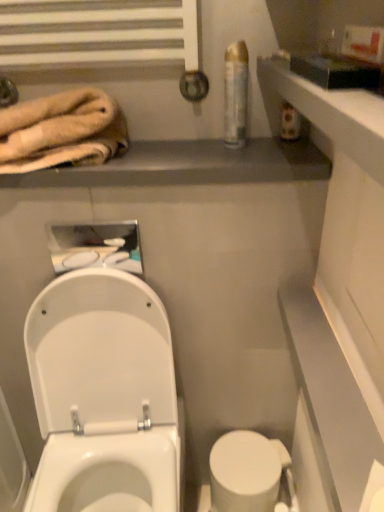
Question: Does white glossy toilet at lower left have a greater width compared to clear plastic can at upper right?

Choices:
 (A) yes
 (B) no

Answer: (A)

Question: Is white glossy toilet at lower left located outside clear plastic can at upper right?

Choices:
 (A) no
 (B) yes

Answer: (B)

Question: Does white glossy toilet at lower left appear on the left side of clear plastic can at upper right?

Choices:
 (A) yes
 (B) no

Answer: (A)

Question: Does white glossy toilet at lower left have a lesser height compared to clear plastic can at upper right?

Choices:
 (A) yes
 (B) no

Answer: (B)

Question: Does white glossy toilet at lower left have a lesser width compared to clear plastic can at upper right?

Choices:
 (A) yes
 (B) no

Answer: (B)

Question: Considering their positions, is white glossy toilet at lower left located in front of or behind white glossy toilet bowl at lower center?

Choices:
 (A) behind
 (B) front

Answer: (B)

Question: Considering the positions of point (89, 502) and point (246, 506), is point (89, 502) closer or farther from the camera than point (246, 506)?

Choices:
 (A) closer
 (B) farther

Answer: (B)

Question: From a real-world perspective, is white glossy toilet at lower left physically located above or below white glossy toilet bowl at lower center?

Choices:
 (A) below
 (B) above

Answer: (B)

Question: Looking at the image, does white glossy toilet at lower left seem bigger or smaller compared to white glossy toilet bowl at lower center?

Choices:
 (A) big
 (B) small

Answer: (A)

Question: Is white glossy toilet at lower left inside the boundaries of beige plush towel at upper left, or outside?

Choices:
 (A) inside
 (B) outside

Answer: (B)

Question: From the image's perspective, is white glossy toilet at lower left located above or below beige plush towel at upper left?

Choices:
 (A) above
 (B) below

Answer: (B)

Question: In the image, is white glossy toilet at lower left positioned in front of or behind beige plush towel at upper left?

Choices:
 (A) behind
 (B) front

Answer: (B)

Question: Visually, is white glossy toilet at lower left positioned to the left or to the right of beige plush towel at upper left?

Choices:
 (A) left
 (B) right

Answer: (B)

Question: From their relative heights in the image, would you say beige plush towel at upper left is taller or shorter than white glossy toilet at lower left?

Choices:
 (A) tall
 (B) short

Answer: (B)

Question: Is beige plush towel at upper left wider or thinner than white glossy toilet at lower left?

Choices:
 (A) thin
 (B) wide

Answer: (A)